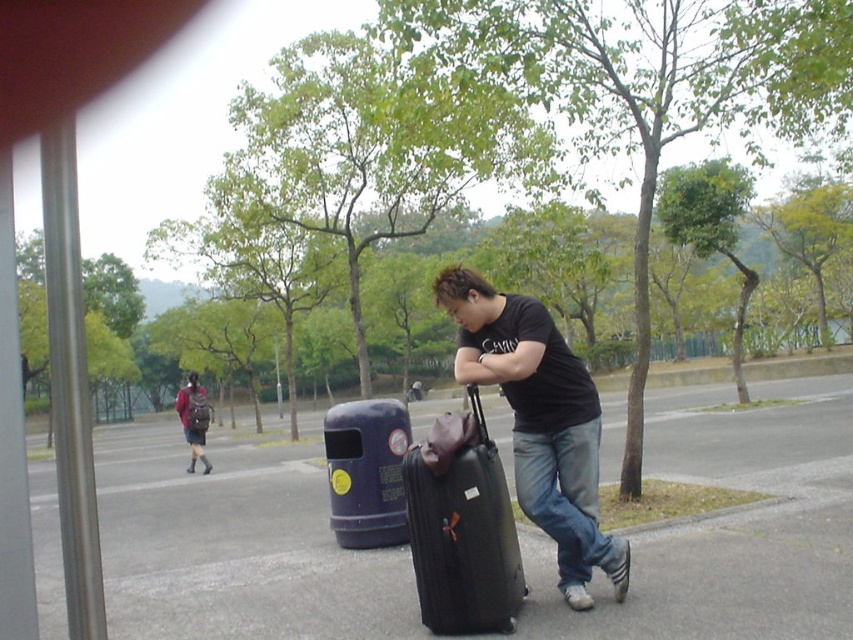
Looking at this image, you are helping someone move and need to fit their luggage into a trunk that can only accommodate items narrower than 18 inches. You see the black matte suitcase at center and the black hard suitcase at center. Which one is more likely to fit in the trunk?

The black hard suitcase at center has a narrower width than the black matte suitcase at center, so it is more likely to fit in the trunk that can only accommodate items narrower than 18 inches.

You are trying to decide which suitcase to take for your trip. You notice both the black matte suitcase at center and the black hard suitcase at center. Which one is taller?

The black matte suitcase at center is taller than the black hard suitcase at center.

You are standing at the point with coordinates point (444, 458) and want to move to the point with coordinates point (592, 522). Is the point you want to reach located behind you or in front of you?

The point (592, 522) is behind point (444, 458), so the point you want to reach is located behind you.